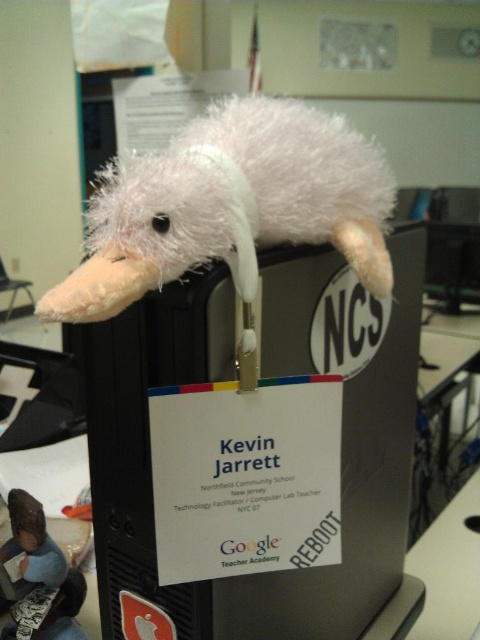
Question: Which point is closer to the camera taking this photo?

Choices:
 (A) (303, 209)
 (B) (408, 269)
 (C) (11, 529)

Answer: (A)

Question: Which object is farther from the camera taking this photo?

Choices:
 (A) black matte computer at center
 (B) white fluffy kiwi at upper center

Answer: (A)

Question: Does black matte computer at center have a greater width compared to fluffy white plush toy at upper center?

Choices:
 (A) yes
 (B) no

Answer: (A)

Question: Does white fluffy kiwi at upper center appear on the left side of fluffy white plush toy at upper center?

Choices:
 (A) yes
 (B) no

Answer: (B)

Question: Is black matte computer at center above white fluffy kiwi at upper center?

Choices:
 (A) no
 (B) yes

Answer: (A)

Question: Which point is closer to the camera?

Choices:
 (A) fluffy white plush toy at upper center
 (B) white fluffy kiwi at upper center

Answer: (B)